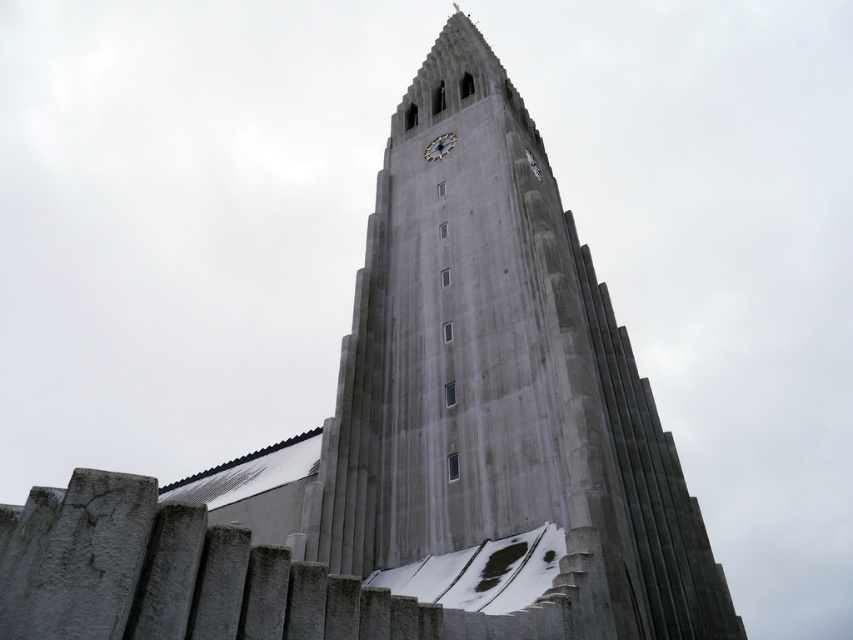
You are standing in front of the church tower and want to take a photo of both the smooth concrete fence at lower left and the white textured clock at upper center. Which object should you focus on first to ensure both are in clear view?

You should focus on the smooth concrete fence at lower left first because it is closer to you than the white textured clock at upper center, so adjusting focus from near to far will help both be in clear view.

You are standing in front of the church tower and want to take a photo of both the smooth concrete fence at lower left and the white textured clock at upper center. Which object should you adjust your camera to focus on first to ensure both are in the frame?

The smooth concrete fence at lower left is positioned on the left side of the white textured clock at upper center. To capture both in the frame, focus on the white textured clock at upper center first, as it is higher up, then adjust to include the fence on the left.

You are an architect analyzing the modernist church tower. You notice the smooth concrete fence at lower left and the white textured clock at upper center. Which object has a greater width?

The smooth concrete fence at lower left has a greater width than the white textured clock at upper center.